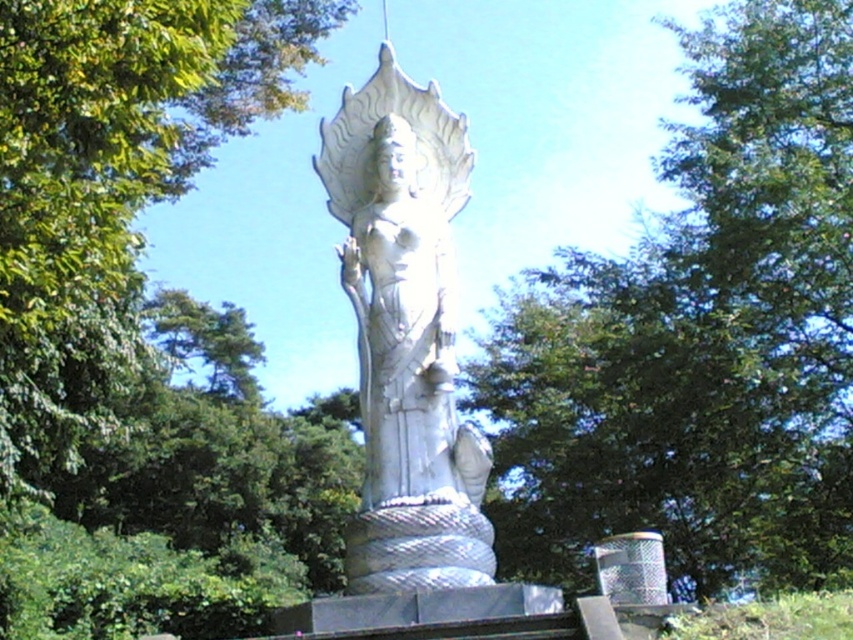
You are planning to take a photo of the white stone statue at center and want to ensure the green leafy tree at center is visible in the background. Given their sizes, will the tree appear larger or smaller than the statue in your photo?

The green leafy tree at center is larger in size compared to the white stone statue at center, so in the photo, the tree will appear larger than the statue.

Looking at this image, you are a photographer planning to take a picture of the white stone statue at center and the green leafy tree at upper left. Which object should you focus on first if you want to capture both in a single frame without moving the camera?

The green leafy tree at upper left is positioned on the left side of the white stone statue at center, so you should focus on the white stone statue at center first to ensure both are in frame.

You are a visitor in the park and see the green leafy tree at center and the green leafy tree at upper left. Which tree is located more to the left?

The green leafy tree at upper left is more to the left side than the green leafy tree at center.